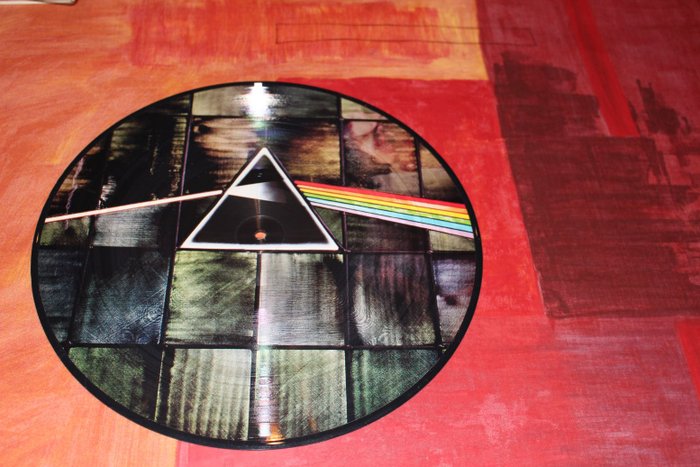
The image size is (700, 467). What are the coordinates of `light source` in the screenshot? It's located at (61, 217).